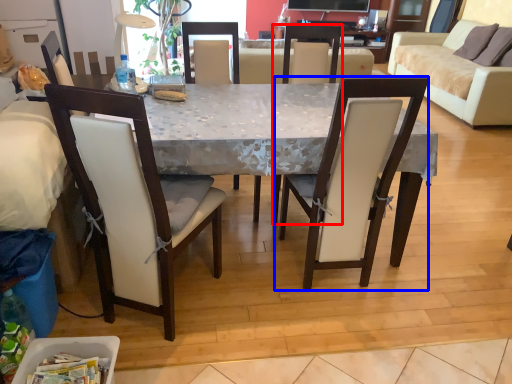
Question: Which of the following is the closest to the observer, chair (highlighted by a red box) or chair (highlighted by a blue box)?

Choices:
 (A) chair
 (B) chair

Answer: (B)